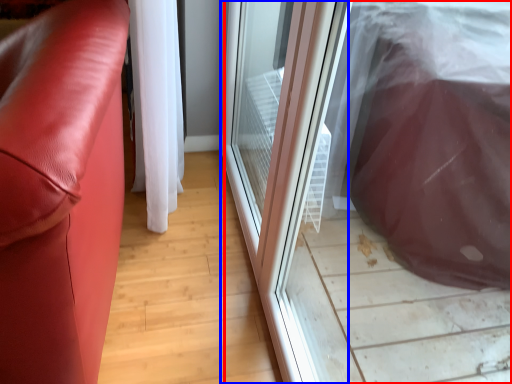
Question: Which point is further to the camera, screen door (highlighted by a red box) or screen door (highlighted by a blue box)?

Choices:
 (A) screen door
 (B) screen door

Answer: (B)